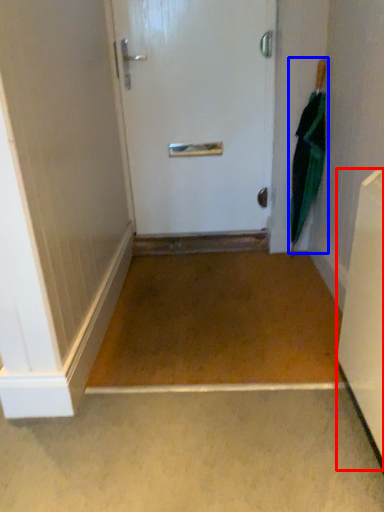
Question: Which object is further to the camera taking this photo, appliance (highlighted by a red box) or umbrella (highlighted by a blue box)?

Choices:
 (A) appliance
 (B) umbrella

Answer: (B)